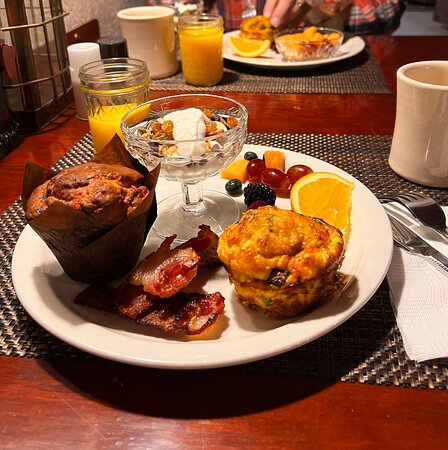
This screenshot has height=450, width=448. Identify the location of white napkin. (405, 328).